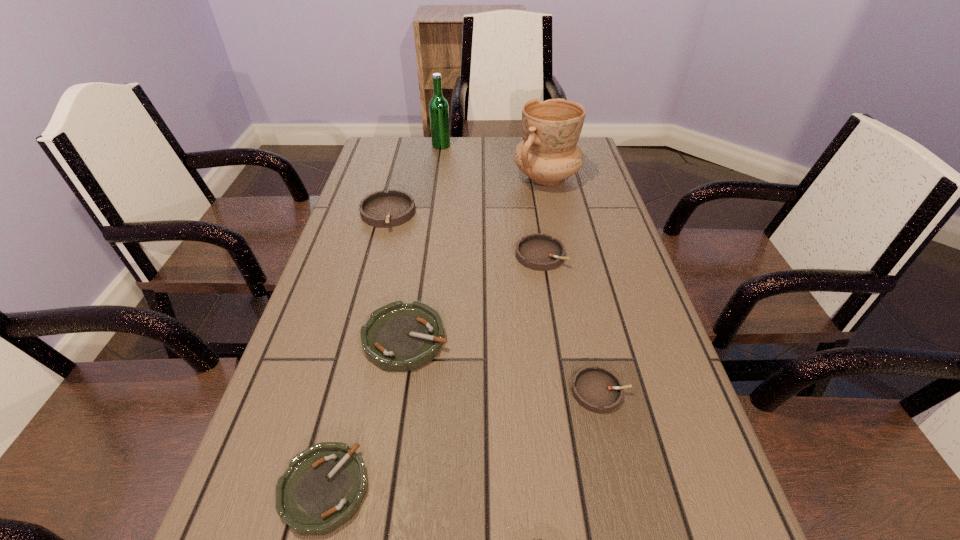
Find the location of a particular element. The width and height of the screenshot is (960, 540). beer bottle is located at coordinates (438, 107).

I want to click on the farthest object, so click(438, 107).

The image size is (960, 540). I want to click on beige pottery, so click(548, 154).

This screenshot has height=540, width=960. Find the location of `the sixth nearest object`. the sixth nearest object is located at coordinates (548, 154).

In order to click on the tallest ashtray in this screenshot , I will do `click(381, 209)`.

Find the location of a particular element. The image size is (960, 540). the farthest gray ashtray is located at coordinates (381, 209).

Locate an element on the screen. The image size is (960, 540). the second biggest gray ashtray is located at coordinates (540, 252).

This screenshot has height=540, width=960. I want to click on the second farthest gray ashtray, so click(540, 252).

The height and width of the screenshot is (540, 960). What are the coordinates of `the bigger green ashtray` in the screenshot? It's located at (399, 336).

The image size is (960, 540). What are the coordinates of `the smallest gray ashtray` in the screenshot? It's located at (597, 389).